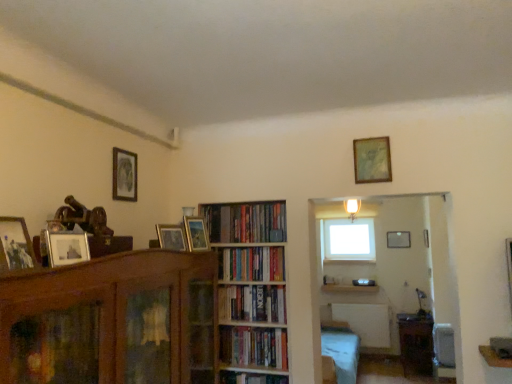
At what (x,y) coordinates should I click in order to perform the action: click on hardcover books at center, the first book when ordered from top to bottom. Please return your answer as a coordinate pair (x, y). Looking at the image, I should click on (245, 222).

Locate an element on the screen. The image size is (512, 384). hardcover books at center, which ranks as the first book in bottom-to-top order is located at coordinates (253, 347).

What do you see at coordinates (251, 264) in the screenshot? Image resolution: width=512 pixels, height=384 pixels. I see `hardcover books at center, the 2th book positioned from the top` at bounding box center [251, 264].

Describe the element at coordinates (253, 303) in the screenshot. I see `hardcover books at center, which appears as the third book when viewed from the top` at that location.

Where is `wooden picture frame at upper center, which ranks as the second picture frame in right-to-left order`? This screenshot has height=384, width=512. wooden picture frame at upper center, which ranks as the second picture frame in right-to-left order is located at coordinates (372, 160).

The width and height of the screenshot is (512, 384). In order to click on the 2nd picture frame to the left of the hardcover books at center, which ranks as the first book in bottom-to-top order, counting from the anchor's position in this screenshot , I will do `click(170, 237)`.

Considering the relative positions of wooden picture frame at center, which ranks as the 5th picture frame in back-to-front order, and hardcover books at center, which ranks as the first book in bottom-to-top order, in the image provided, is wooden picture frame at center, which ranks as the 5th picture frame in back-to-front order, in front of hardcover books at center, which ranks as the first book in bottom-to-top order,?

Yes.

Looking at this image, considering the relative sizes of wooden picture frame at center, which is counted as the 2th picture frame, starting from the bottom, and hardcover books at center, which appears as the 4th book when viewed from the top, in the image provided, is wooden picture frame at center, which is counted as the 2th picture frame, starting from the bottom, bigger than hardcover books at center, which appears as the 4th book when viewed from the top,?

No, wooden picture frame at center, which is counted as the 2th picture frame, starting from the bottom, is not bigger than hardcover books at center, which appears as the 4th book when viewed from the top.

From the image's perspective, is wooden picture frame at center, arranged as the fourth picture frame when viewed from the right, below hardcover books at center, which appears as the 4th book when viewed from the top?

Incorrect, from the image's perspective, wooden picture frame at center, arranged as the fourth picture frame when viewed from the right, is higher than hardcover books at center, which appears as the 4th book when viewed from the top.

Find the location of a particular element. This screenshot has width=512, height=384. window above the wooden picture frame at left, the 1th picture frame in the front-to-back sequence (from a real-world perspective) is located at coordinates (349, 240).

Which is in front, white glass window at upper center or wooden picture frame at left, placed as the sixth picture frame when sorted from back to front?

wooden picture frame at left, placed as the sixth picture frame when sorted from back to front, is closer to the camera.

Could you tell me if white glass window at upper center is turned towards wooden picture frame at left, placed as the sixth picture frame when sorted from back to front?

Yes, white glass window at upper center is aimed at wooden picture frame at left, placed as the sixth picture frame when sorted from back to front.

Considering the points (370, 258) and (13, 252), which point is behind, point (370, 258) or point (13, 252)?

The point (370, 258) is more distant.

Is matte black picture frame at upper left, which is the 4th picture frame in back-to-front order, located outside hardcover books at center, which appears as the 4th book when viewed from the top?

matte black picture frame at upper left, which is the 4th picture frame in back-to-front order, is positioned outside hardcover books at center, which appears as the 4th book when viewed from the top.

From the picture: How much distance is there between matte black picture frame at upper left, which is the 5th picture frame from bottom to top, and hardcover books at center, which ranks as the first book in bottom-to-top order?

matte black picture frame at upper left, which is the 5th picture frame from bottom to top, is 3.85 feet from hardcover books at center, which ranks as the first book in bottom-to-top order.

Is matte black picture frame at upper left, the 3th picture frame in the front-to-back sequence, far from hardcover books at center, which ranks as the first book in bottom-to-top order?

matte black picture frame at upper left, the 3th picture frame in the front-to-back sequence, is far away from hardcover books at center, which ranks as the first book in bottom-to-top order.

Can you confirm if matte black picture frame at upper left, which is the 5th picture frame from bottom to top, is shorter than hardcover books at center, which appears as the 4th book when viewed from the top?

No, matte black picture frame at upper left, which is the 5th picture frame from bottom to top, is not shorter than hardcover books at center, which appears as the 4th book when viewed from the top.

Is hardcover books at center, acting as the fourth book starting from the bottom, positioned with its back to hardcover books at center, which appears as the 4th book when viewed from the top?

No, hardcover books at center, acting as the fourth book starting from the bottom, is not facing the opposite direction of hardcover books at center, which appears as the 4th book when viewed from the top.

From a real-world perspective, which object stands above the other?

From a 3D spatial view, hardcover books at center, acting as the fourth book starting from the bottom, is above.

How much distance is there between hardcover books at center, acting as the fourth book starting from the bottom, and hardcover books at center, which ranks as the first book in bottom-to-top order?

hardcover books at center, acting as the fourth book starting from the bottom, is 25.76 inches away from hardcover books at center, which ranks as the first book in bottom-to-top order.

Between matte gold picture frame at upper center, which ranks as the 6th picture frame in top-to-bottom order, and wooden picture frame at upper center, the 5th picture frame in the left-to-right sequence, which one appears on the left side from the viewer's perspective?

wooden picture frame at upper center, the 5th picture frame in the left-to-right sequence.

From the image's perspective, would you say matte gold picture frame at upper center, the 6th picture frame in the left-to-right sequence, is positioned over wooden picture frame at upper center, which is counted as the second picture frame, starting from the back?

No.

Is matte gold picture frame at upper center, the 6th picture frame in the left-to-right sequence, directly adjacent to wooden picture frame at upper center, acting as the fifth picture frame starting from the front?

matte gold picture frame at upper center, the 6th picture frame in the left-to-right sequence, and wooden picture frame at upper center, acting as the fifth picture frame starting from the front, are clearly separated.

Is matte black picture frame at upper left, the 3th picture frame in the front-to-back sequence, far away from wooden picture frame at left, the second picture frame positioned from the left?

matte black picture frame at upper left, the 3th picture frame in the front-to-back sequence, is far away from wooden picture frame at left, the second picture frame positioned from the left.

How distant is matte black picture frame at upper left, the 3th picture frame in the front-to-back sequence, from wooden picture frame at left, the second picture frame positioned from the left?

They are 1.07 meters apart.

In the scene shown: From the image's perspective, who appears lower, matte black picture frame at upper left, marked as the second picture frame in a top-to-bottom arrangement, or wooden picture frame at left, which is the 4th picture frame from bottom to top?

wooden picture frame at left, which is the 4th picture frame from bottom to top, appears lower in the image.

Which picture frame is the 3rd one when counting from the left side of the wooden bookshelf at center? Please provide its 2D coordinates.

[(15, 245)]

Is wooden bookshelf at center next to wooden picture frame at left, placed as the sixth picture frame when sorted from back to front, and touching it?

No, wooden bookshelf at center is not in contact with wooden picture frame at left, placed as the sixth picture frame when sorted from back to front.

From the image's perspective, is wooden bookshelf at center beneath wooden picture frame at left, placed as the sixth picture frame when sorted from back to front?

Correct, wooden bookshelf at center appears lower than wooden picture frame at left, placed as the sixth picture frame when sorted from back to front, in the image.

Between wooden bookshelf at center and wooden picture frame at left, which is the 4th picture frame from bottom to top, which one has smaller width?

wooden picture frame at left, which is the 4th picture frame from bottom to top, is thinner.

This screenshot has height=384, width=512. I want to click on the 2nd picture frame to the left when counting from the hardcover books at center, which appears as the 4th book when viewed from the top, so click(x=170, y=237).

Image resolution: width=512 pixels, height=384 pixels. Find the location of `window behind the wooden picture frame at left, placed as the sixth picture frame when sorted from back to front`. window behind the wooden picture frame at left, placed as the sixth picture frame when sorted from back to front is located at coordinates (349, 240).

From the image, which object appears to be nearer to matte black picture frame at upper left, marked as the second picture frame in a top-to-bottom arrangement, hardcover books at center, arranged as the third book when ordered from the bottom, or hardcover books at center, which appears as the 4th book when viewed from the top?

hardcover books at center, arranged as the third book when ordered from the bottom, lies closer to matte black picture frame at upper left, marked as the second picture frame in a top-to-bottom arrangement, than the other object.

Looking at the image, which one is located further to hardcover books at center, the 2th book positioned from the top, hardcover books at center, which ranks as the first book in bottom-to-top order, or wooden picture frame at center, which appears as the third picture frame when ordered from the bottom?

The object further to hardcover books at center, the 2th book positioned from the top, is wooden picture frame at center, which appears as the third picture frame when ordered from the bottom.

Considering their positions, is hardcover books at center, which ranks as the first book in bottom-to-top order, positioned further to wooden picture frame at upper center, acting as the fifth picture frame starting from the front, than matte gold picture frame at upper center, which appears as the first picture frame when viewed from the back?

The object further to wooden picture frame at upper center, acting as the fifth picture frame starting from the front, is matte gold picture frame at upper center, which appears as the first picture frame when viewed from the back.

Estimate the real-world distances between objects in this image. Which object is further from hardcover books at center, the 2th book from the bottom, wooden table at lower right or hardcover books at center, arranged as the third book when ordered from the bottom?

wooden table at lower right is positioned further to the anchor hardcover books at center, the 2th book from the bottom.

Based on the photo, looking at the image, which one is located further to hardcover books at center, which appears as the 4th book when viewed from the top, hardcover books at center, acting as the fourth book starting from the bottom, or white glass window at upper center?

Based on the image, white glass window at upper center appears to be further to hardcover books at center, which appears as the 4th book when viewed from the top.

From the picture: When comparing their distances from wooden picture frame at upper center, which ranks as the second picture frame in right-to-left order, does wooden picture frame at center, which is counted as the 2th picture frame, starting from the bottom, or hardcover books at center, arranged as the third book when ordered from the bottom, seem closer?

The object closer to wooden picture frame at upper center, which ranks as the second picture frame in right-to-left order, is hardcover books at center, arranged as the third book when ordered from the bottom.

Looking at the image, which one is located further to matte black picture frame at upper left, acting as the first picture frame starting from the left, wooden picture frame at center, which ranks as the fourth picture frame in top-to-bottom order, or brown wooden bookcase at left?

brown wooden bookcase at left is positioned further to the anchor matte black picture frame at upper left, acting as the first picture frame starting from the left.

From the image, which object appears to be nearer to hardcover books at center, which appears as the 4th book when viewed from the top, wooden table at lower right or wooden picture frame at upper center, the 5th picture frame in the left-to-right sequence?

wooden picture frame at upper center, the 5th picture frame in the left-to-right sequence, is positioned closer to the anchor hardcover books at center, which appears as the 4th book when viewed from the top.

This screenshot has height=384, width=512. What are the coordinates of `table located between hardcover books at center, the 2th book from the bottom, and matte gold picture frame at upper center, which is the 1th picture frame in right-to-left order, in the depth direction` in the screenshot? It's located at (416, 343).

Where is `table between matte black picture frame at upper left, the 3th picture frame in the front-to-back sequence, and matte gold picture frame at upper center, which is the 1th picture frame in right-to-left order, along the z-axis`? Image resolution: width=512 pixels, height=384 pixels. table between matte black picture frame at upper left, the 3th picture frame in the front-to-back sequence, and matte gold picture frame at upper center, which is the 1th picture frame in right-to-left order, along the z-axis is located at coordinates (x=416, y=343).

The width and height of the screenshot is (512, 384). What are the coordinates of `book that lies between wooden picture frame at center, which ranks as the fourth picture frame in top-to-bottom order, and wooden bookshelf at center from top to bottom` in the screenshot? It's located at (251, 264).

Locate an element on the screen. The height and width of the screenshot is (384, 512). book between hardcover books at center, which appears as the third book when viewed from the top, and wooden table at lower right in the front-back direction is located at coordinates [245, 222].